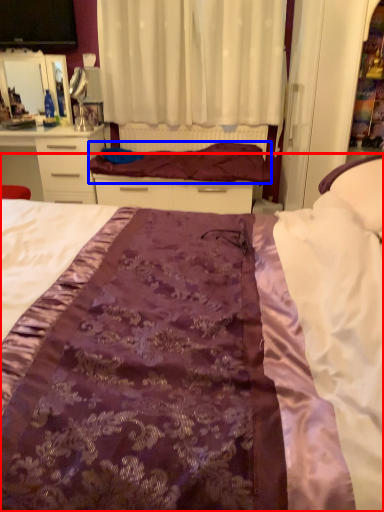
Question: Which object appears farthest to the camera in this image, bed (highlighted by a red box) or blanket (highlighted by a blue box)?

Choices:
 (A) bed
 (B) blanket

Answer: (B)